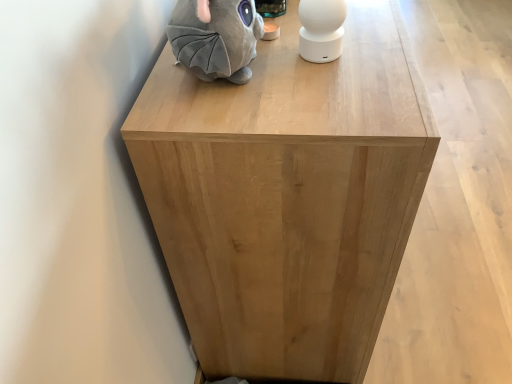
Question: Which direction should I rotate to look at white matte speaker at upper center, which is counted as the first toy, starting from the right?

Choices:
 (A) left
 (B) right

Answer: (B)

Question: Does natural wood cabinet at center have a smaller size compared to white matte speaker at upper center, the second toy positioned from the left?

Choices:
 (A) no
 (B) yes

Answer: (A)

Question: Is natural wood cabinet at center wider than white matte speaker at upper center, which is counted as the first toy, starting from the right?

Choices:
 (A) yes
 (B) no

Answer: (A)

Question: Does natural wood cabinet at center appear on the right side of white matte speaker at upper center, the second toy positioned from the left?

Choices:
 (A) yes
 (B) no

Answer: (A)

Question: From the image's perspective, is natural wood cabinet at center below white matte speaker at upper center, which is counted as the first toy, starting from the right?

Choices:
 (A) no
 (B) yes

Answer: (A)

Question: Is natural wood cabinet at center far away from white matte speaker at upper center, which is counted as the first toy, starting from the right?

Choices:
 (A) yes
 (B) no

Answer: (B)

Question: Is natural wood cabinet at center thinner than white matte speaker at upper center, the second toy positioned from the left?

Choices:
 (A) no
 (B) yes

Answer: (A)

Question: Is natural wood cabinet at center facing away from gray plush toy at upper left, marked as the 2th toy in a right-to-left arrangement?

Choices:
 (A) yes
 (B) no

Answer: (B)

Question: Is natural wood cabinet at center at the left side of gray plush toy at upper left, marked as the 2th toy in a right-to-left arrangement?

Choices:
 (A) yes
 (B) no

Answer: (B)

Question: Would you say natural wood cabinet at center is outside gray plush toy at upper left, the first toy viewed from the left?

Choices:
 (A) yes
 (B) no

Answer: (A)

Question: Does natural wood cabinet at center turn towards gray plush toy at upper left, the first toy viewed from the left?

Choices:
 (A) no
 (B) yes

Answer: (A)

Question: Would you say natural wood cabinet at center contains gray plush toy at upper left, the first toy viewed from the left?

Choices:
 (A) yes
 (B) no

Answer: (B)

Question: Considering the relative sizes of natural wood cabinet at center and gray plush toy at upper left, the first toy viewed from the left, in the image provided, is natural wood cabinet at center bigger than gray plush toy at upper left, the first toy viewed from the left,?

Choices:
 (A) yes
 (B) no

Answer: (A)

Question: Does white matte speaker at upper center, the second toy positioned from the left, have a smaller size compared to natural wood cabinet at center?

Choices:
 (A) no
 (B) yes

Answer: (B)